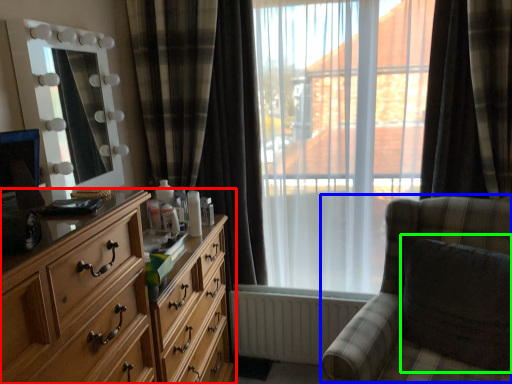
Question: Which object is the farthest from chest of drawers (highlighted by a red box)? Choose among these: rocking chair (highlighted by a blue box) or swivel chair (highlighted by a green box).

Choices:
 (A) rocking chair
 (B) swivel chair

Answer: (B)